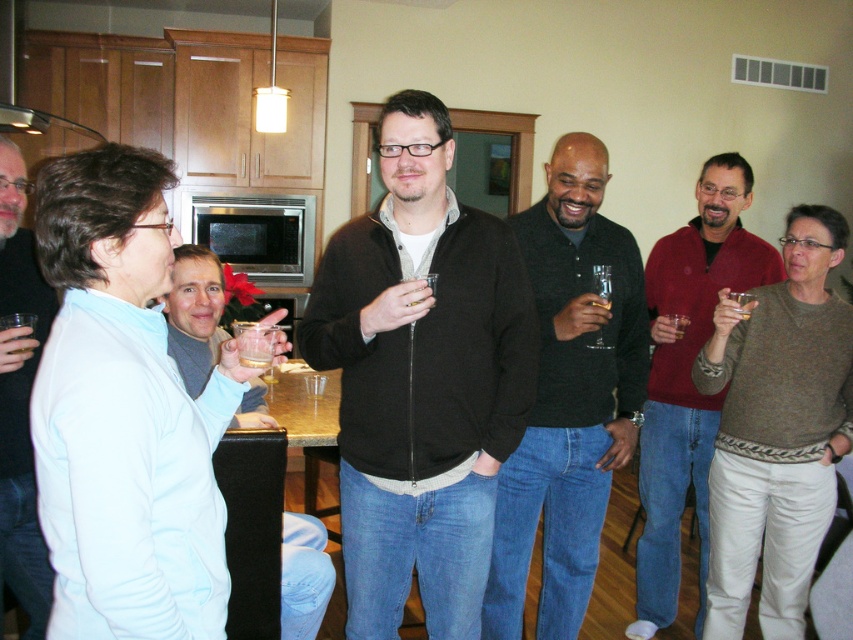
Question: Among these objects, which one is nearest to the camera?

Choices:
 (A) matte black jacket at center
 (B) dark gray sweater at center

Answer: (A)

Question: Is matte black sweater at center below dark gray sweater at center?

Choices:
 (A) no
 (B) yes

Answer: (A)

Question: Is matte red sweater at center smaller than matte glass at lower left?

Choices:
 (A) no
 (B) yes

Answer: (A)

Question: Among these objects, which one is farthest from the camera?

Choices:
 (A) matte black jacket at center
 (B) matte glass at lower left

Answer: (A)

Question: Estimate the real-world distances between objects in this image. Which object is closer to the matte black jacket at center?

Choices:
 (A) matte red sweater at center
 (B) dark gray sweater at center
 (C) clear glass wine glass at center

Answer: (B)

Question: Is matte black sweater at center bigger than translucent plastic cup at center?

Choices:
 (A) yes
 (B) no

Answer: (A)